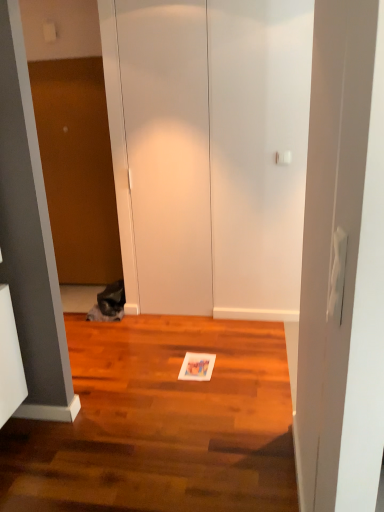
The image size is (384, 512). I want to click on vacant space in brown matte door at left (from a real-world perspective), so click(80, 286).